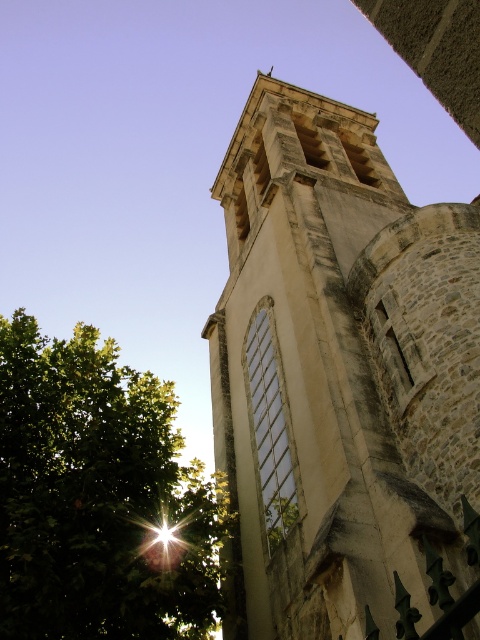
Who is higher up, stone tower at center or green leafy tree at lower left?

Positioned higher is stone tower at center.

Is stone tower at center to the left of green leafy tree at lower left from the viewer's perspective?

Incorrect, stone tower at center is not on the left side of green leafy tree at lower left.

At what (x,y) coordinates should I click in order to perform the action: click on stone tower at center. Please return your answer as a coordinate pair (x, y). Looking at the image, I should click on (338, 372).